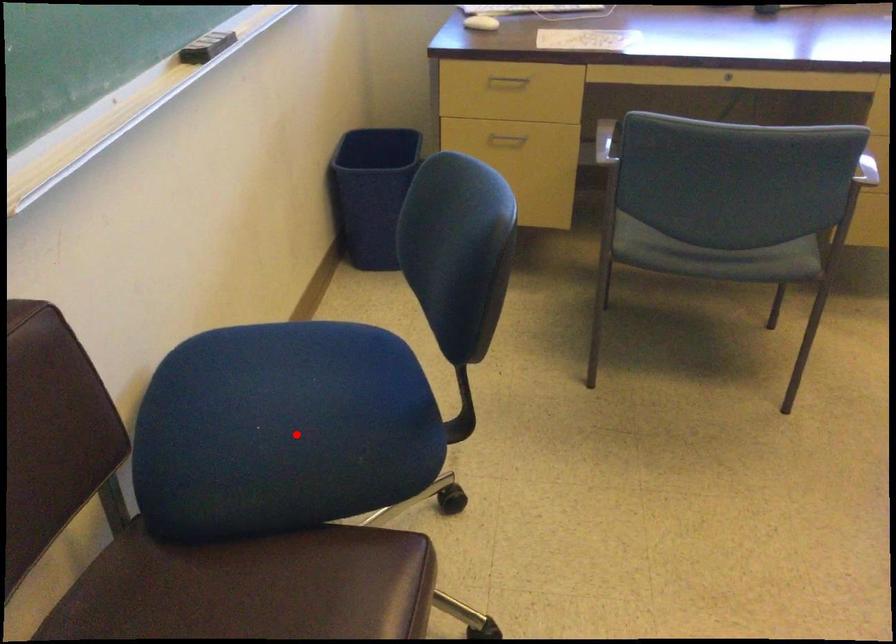
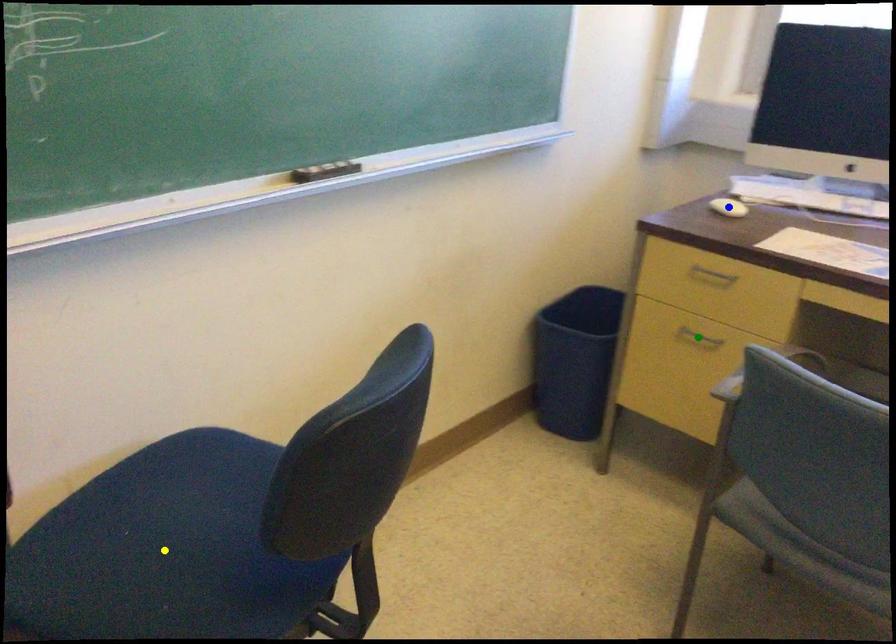
Question: I am providing you with two images of the same scene from different viewpoints. A red point is marked on the first image. You are given multiple points on the second image. Which spot in image 2 lines up with the point in image 1?

Choices:
 (A) green point
 (B) blue point
 (C) yellow point

Answer: (C)